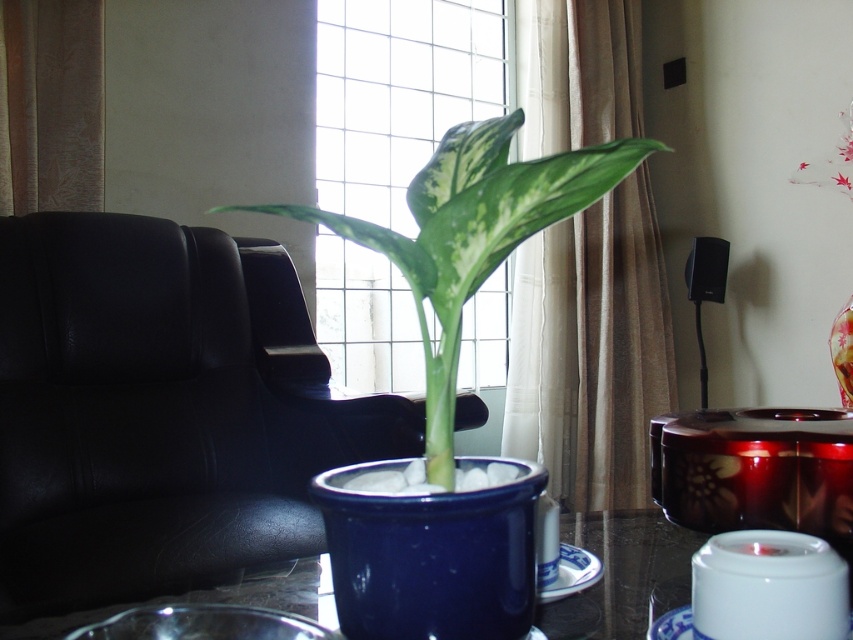
Looking at this image, you are arranging flowers in a living room and see both the blue ceramic vase at center and the transparent glass vase at upper right. Which one is positioned to the left when viewed from the front?

The blue ceramic vase at center is positioned to the left of the transparent glass vase at upper right.

You are an interior designer planning to place a small decorative item on the coffee table. The item must be placed exactly at the coordinates of the green glossy leaf at center. What are the coordinates where you should place the item?

The coordinates for the green glossy leaf at center are at point [473,236]. You should place the item at those coordinates.